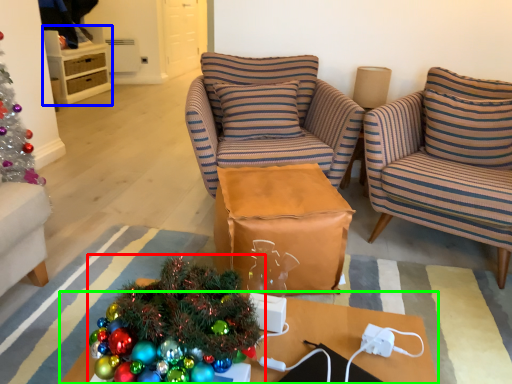
Question: Which is nearer to the christmas tree (highlighted by a red box)? cabinetry (highlighted by a blue box) or desk (highlighted by a green box).

Choices:
 (A) cabinetry
 (B) desk

Answer: (B)